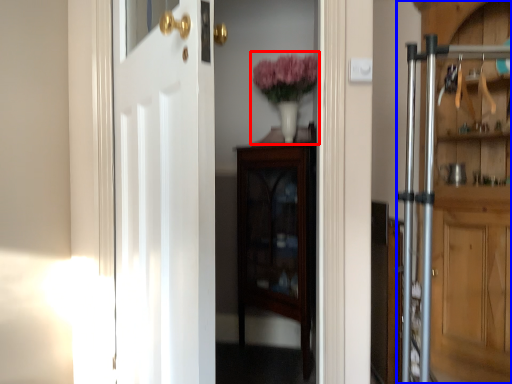
Question: Which object appears farthest to the camera in this image, floral arrangement (highlighted by a red box) or door (highlighted by a blue box)?

Choices:
 (A) floral arrangement
 (B) door

Answer: (A)